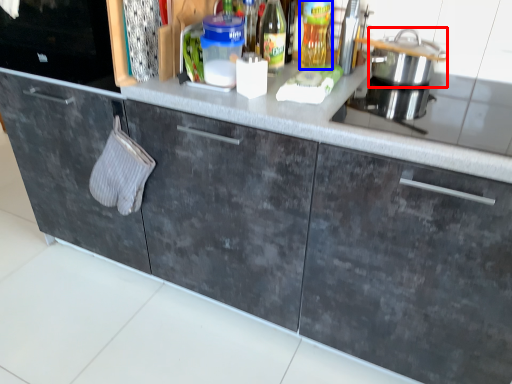
Question: Which object is further to the camera taking this photo, kitchen appliance (highlighted by a red box) or bottle (highlighted by a blue box)?

Choices:
 (A) kitchen appliance
 (B) bottle

Answer: (B)